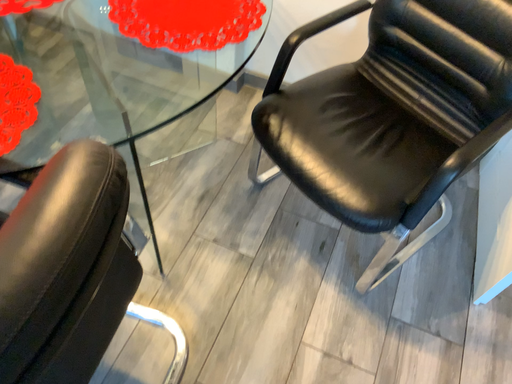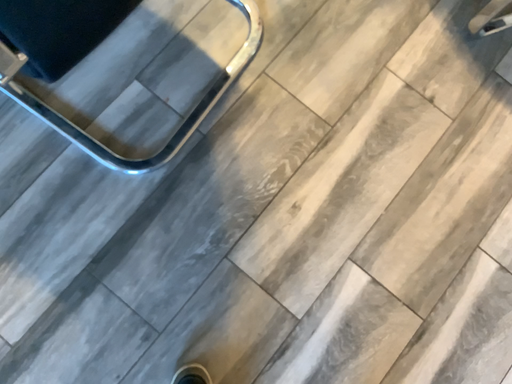
Question: Which way did the camera rotate in the video?

Choices:
 (A) rotated downward
 (B) rotated upward

Answer: (A)